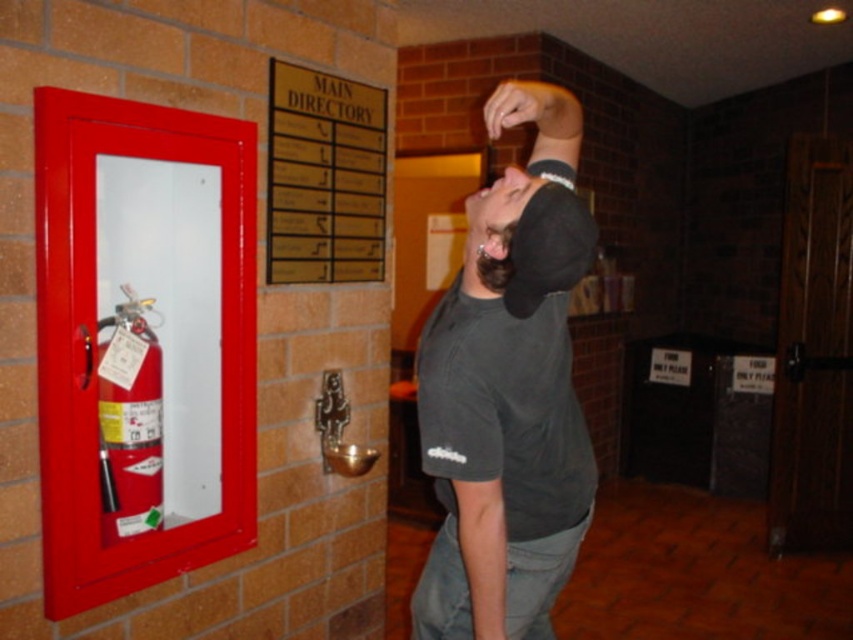
Question: Which point appears closest to the camera in this image?

Choices:
 (A) (486, 348)
 (B) (361, 237)

Answer: (A)

Question: Does dark gray cotton t-shirt at center have a larger size compared to gold metallic directory at upper center?

Choices:
 (A) yes
 (B) no

Answer: (A)

Question: Which of the following is the closest to the observer?

Choices:
 (A) dark gray cotton t-shirt at center
 (B) matte black hand at upper center
 (C) gold metallic directory at upper center

Answer: (A)

Question: Can you confirm if dark gray cotton t-shirt at center is positioned below matte black hand at upper center?

Choices:
 (A) yes
 (B) no

Answer: (A)

Question: Does dark gray cotton t-shirt at center have a smaller size compared to matte black hand at upper center?

Choices:
 (A) no
 (B) yes

Answer: (A)

Question: Which object is closer to the camera taking this photo?

Choices:
 (A) gold metallic directory at upper center
 (B) matte black hand at upper center
 (C) red matte fire extinguisher at left

Answer: (B)